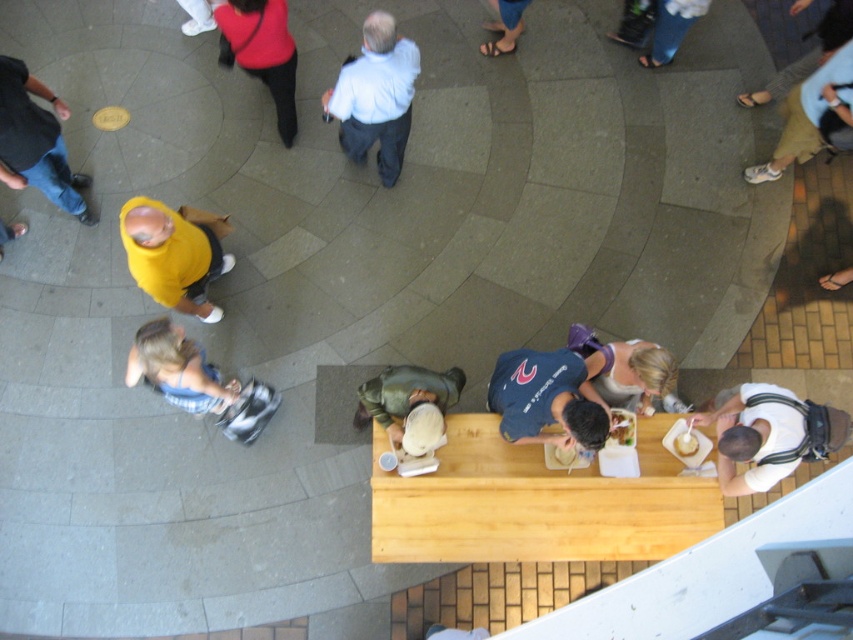
Question: Which point is farther to the camera?

Choices:
 (A) green fabric jacket at center
 (B) matte yellow shirt at upper left
 (C) white cotton shirt at lower right

Answer: (B)

Question: Is matte yellow shirt at upper left thinner than green fabric jacket at center?

Choices:
 (A) no
 (B) yes

Answer: (B)

Question: Among these points, which one is farthest from the camera?

Choices:
 (A) (495, 45)
 (B) (57, 179)

Answer: (A)

Question: Can you confirm if green fabric jacket at center is bigger than white paper cupcake at lower right?

Choices:
 (A) yes
 (B) no

Answer: (A)

Question: Is white cotton shirt at lower right closer to camera compared to light brown leather sandal at upper right?

Choices:
 (A) no
 (B) yes

Answer: (B)

Question: Which object appears closest to the camera in this image?

Choices:
 (A) light brown leather sandal at upper right
 (B) white shirt at upper center
 (C) yellow matte shirt at upper left

Answer: (C)